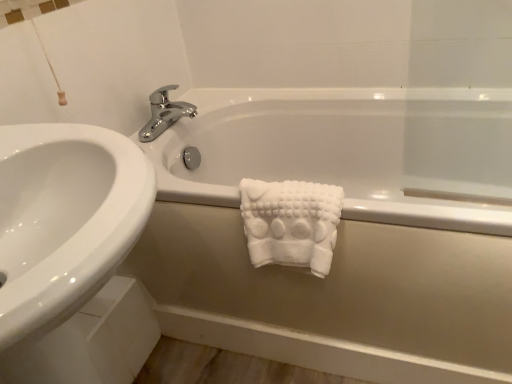
Question: From the image's perspective, relative to white matte bathtub at center, is white glossy sink at upper left above or below?

Choices:
 (A) below
 (B) above

Answer: (A)

Question: From a real-world perspective, is white glossy sink at upper left above or below white matte bathtub at center?

Choices:
 (A) below
 (B) above

Answer: (B)

Question: Which of these objects is positioned farthest from the white glossy sink at upper left?

Choices:
 (A) white fluffy towel at center
 (B) chrome/metallic faucet at upper center
 (C) white matte bathtub at center

Answer: (B)

Question: Which object is the closest to the chrome/metallic faucet at upper center?

Choices:
 (A) white glossy sink at upper left
 (B) white fluffy towel at center
 (C) white matte bathtub at center

Answer: (C)